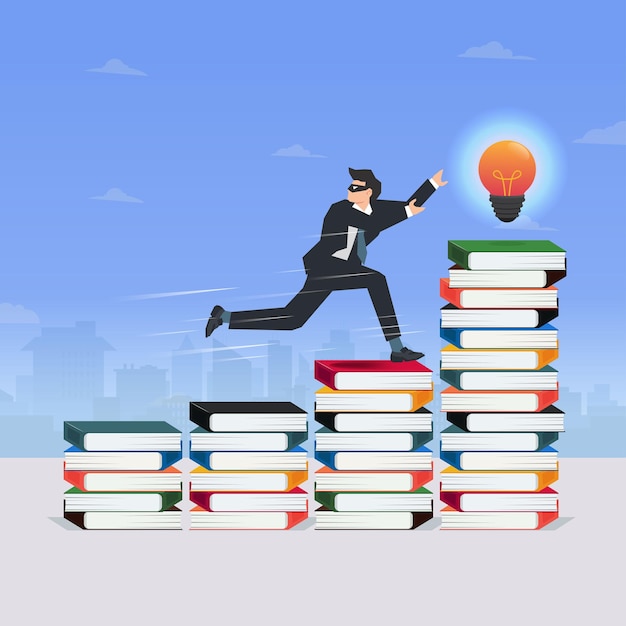
At what (x,y) coordinates should I click in order to perform the action: click on stacks of books. Please return your answer as a coordinate pair (x, y). Looking at the image, I should click on (131, 433), (245, 406), (362, 376), (498, 253).